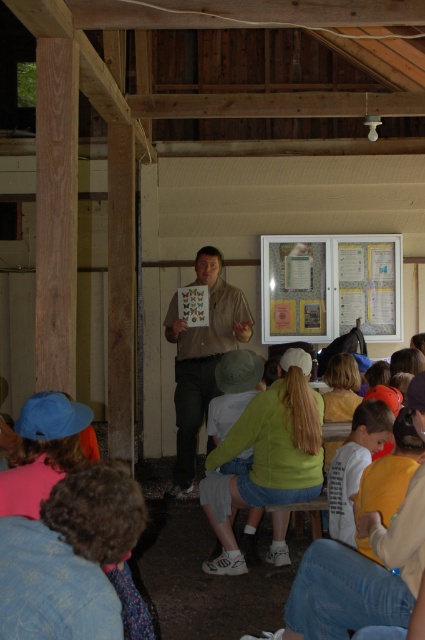
Consider the image. Can you confirm if matte yellow paper at center is taller than matte khaki shirt at center?

In fact, matte yellow paper at center may be shorter than matte khaki shirt at center.

Does matte yellow paper at center have a lesser height compared to matte khaki shirt at center?

Yes.

Between point (380, 253) and point (207, 448), which one is positioned behind?

Positioned behind is point (380, 253).

At what (x,y) coordinates should I click in order to perform the action: click on matte yellow paper at center. Please return your answer as a coordinate pair (x, y). Image resolution: width=425 pixels, height=640 pixels. Looking at the image, I should click on (331, 285).

Is matte yellow paper at center closer to camera compared to white cotton shirt at lower right?

No, it is not.

The image size is (425, 640). What do you see at coordinates (331, 285) in the screenshot?
I see `matte yellow paper at center` at bounding box center [331, 285].

The image size is (425, 640). Identify the location of matte yellow paper at center. (331, 285).

Who is taller, matte khaki shirt at center or white cotton shirt at lower right?

matte khaki shirt at center is taller.

Which is more to the left, matte khaki shirt at center or white cotton shirt at lower right?

Positioned to the left is matte khaki shirt at center.

Measure the distance between matte khaki shirt at center and camera.

matte khaki shirt at center and camera are 5.88 meters apart from each other.

Find the location of `matte khaki shirt at center`. matte khaki shirt at center is located at coordinates (201, 356).